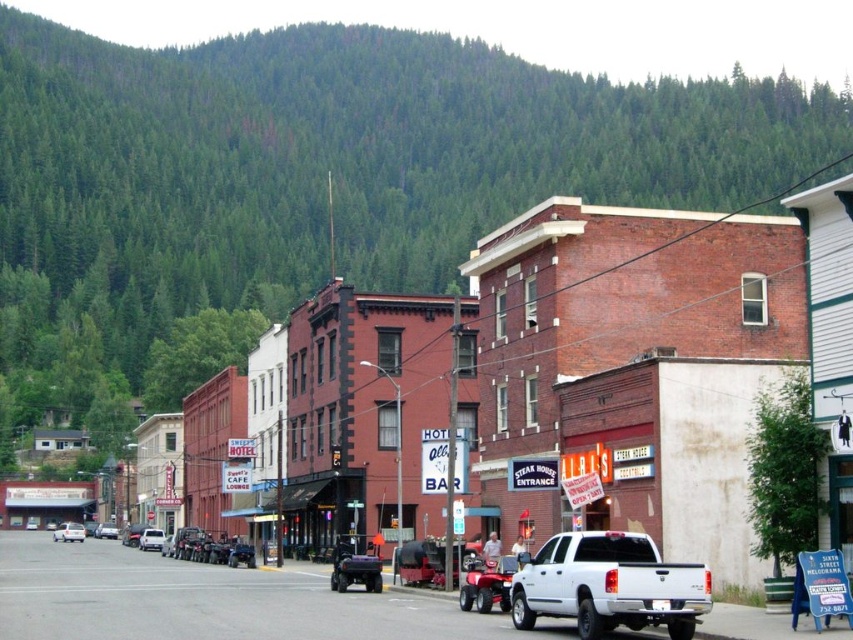
Does white matte car at center come behind silver metallic sedan at center?

No, it is not.

Is white matte car at center shorter than silver metallic sedan at center?

Incorrect, white matte car at center's height does not fall short of silver metallic sedan at center's.

Looking at this image, who is more distant from viewer, (80, 538) or (109, 534)?

The point (109, 534) is behind.

Find the location of `white matte car at center`. white matte car at center is located at coordinates coord(68,531).

Which is above, white matte pickup truck at center or white matte van at center?

white matte pickup truck at center

Between point (671, 568) and point (152, 531), which one is positioned in front?

Point (671, 568) is more forward.

Is point (625, 586) positioned after point (149, 540)?

No, it is not.

The height and width of the screenshot is (640, 853). I want to click on white matte pickup truck at center, so click(x=608, y=584).

Between point (434, 378) and point (96, 532), which one is positioned in front?

Point (434, 378)

Does brick building at center have a greater width compared to silver metallic sedan at center?

Correct, the width of brick building at center exceeds that of silver metallic sedan at center.

Which is behind, point (679, 276) or point (109, 532)?

Positioned behind is point (109, 532).

Find the location of a particular element. The height and width of the screenshot is (640, 853). brick building at center is located at coordinates (624, 304).